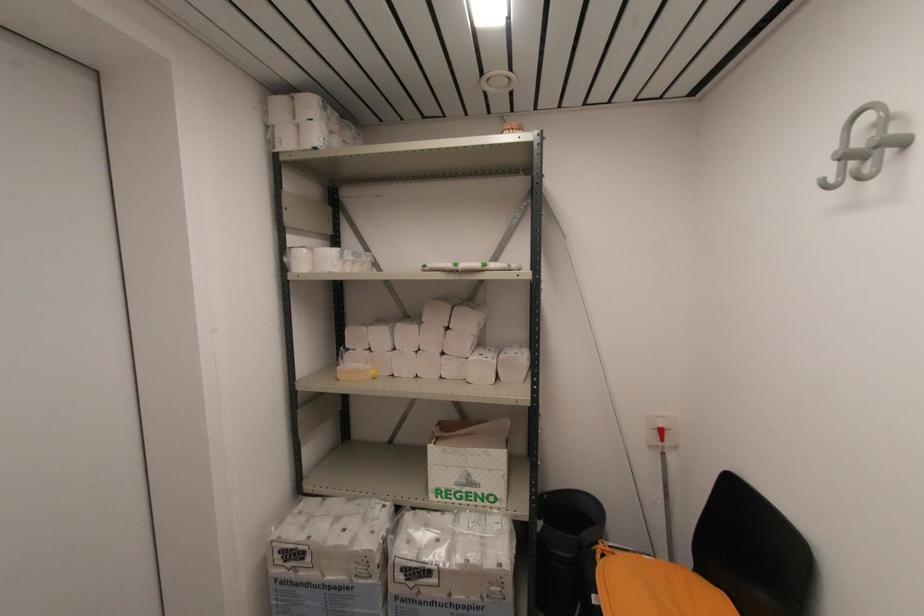
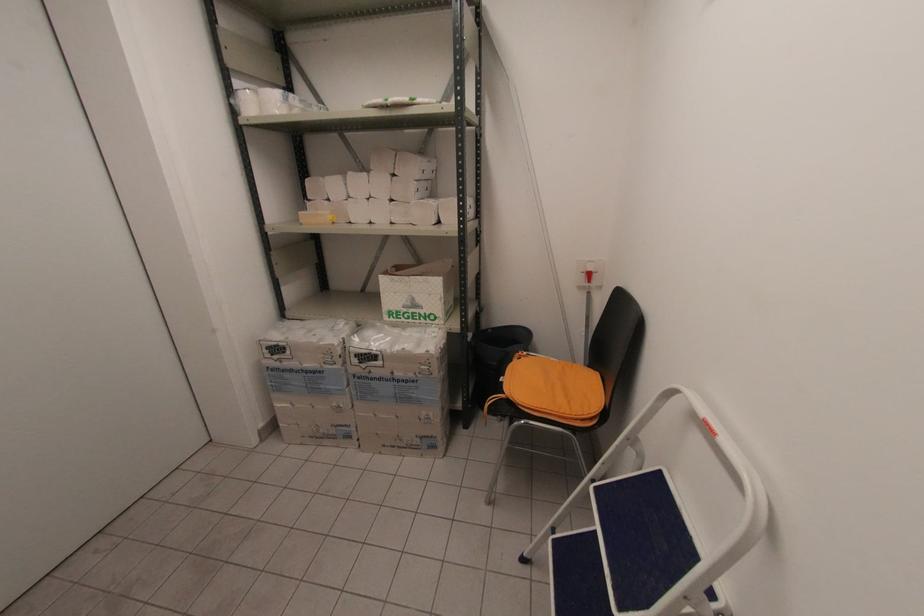
Question: How did the camera likely rotate?

Choices:
 (A) Left
 (B) Right
 (C) Up
 (D) Down

Answer: (D)